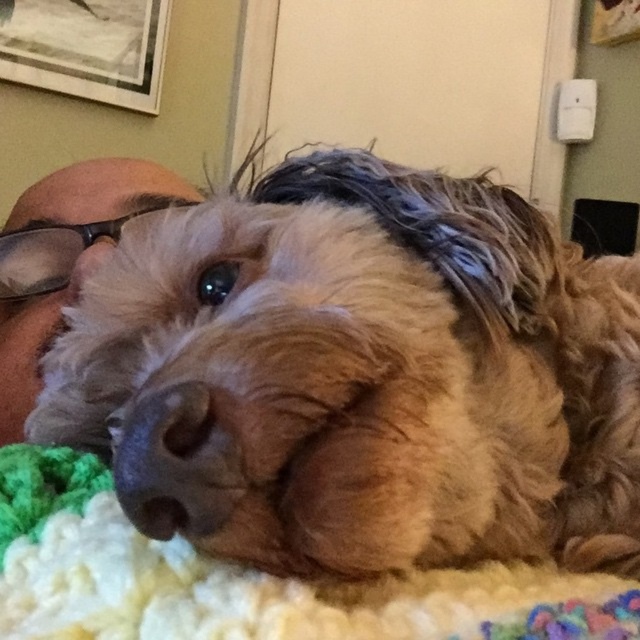
Question: Which point is farther to the camera?

Choices:
 (A) knitted wool blanket at lower center
 (B) brown fluffy dog at center

Answer: (A)

Question: Does brown fluffy dog at center appear on the left side of knitted wool blanket at lower center?

Choices:
 (A) no
 (B) yes

Answer: (A)

Question: Can you confirm if knitted wool blanket at lower center is wider than brown fur at upper left?

Choices:
 (A) yes
 (B) no

Answer: (A)

Question: Which object appears farthest from the camera in this image?

Choices:
 (A) brown fur at upper left
 (B) brown fluffy dog at center

Answer: (A)

Question: Among these points, which one is farthest from the camera?

Choices:
 (A) (132, 193)
 (B) (387, 234)
 (C) (573, 616)

Answer: (A)

Question: Can you confirm if brown fluffy dog at center is positioned to the right of knitted wool blanket at lower center?

Choices:
 (A) yes
 (B) no

Answer: (A)